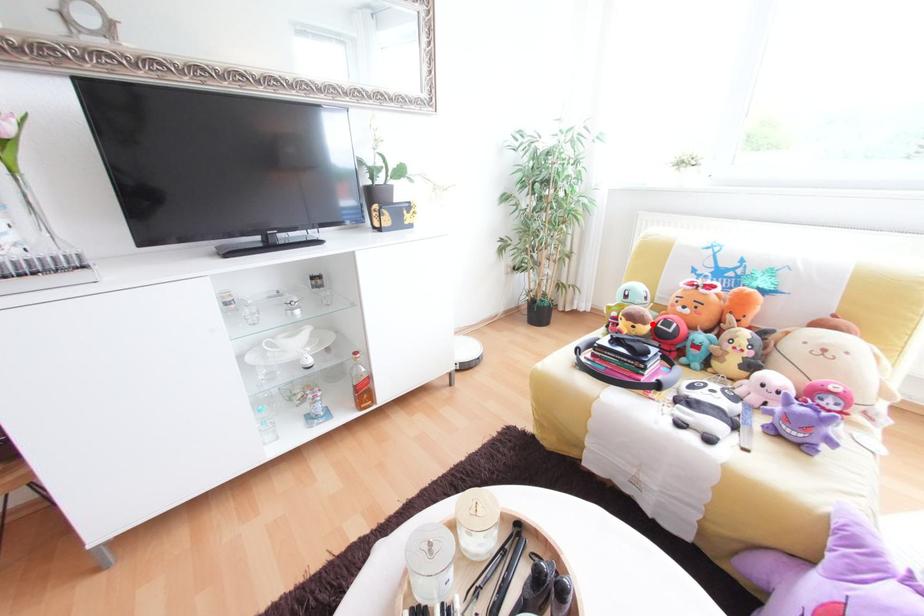
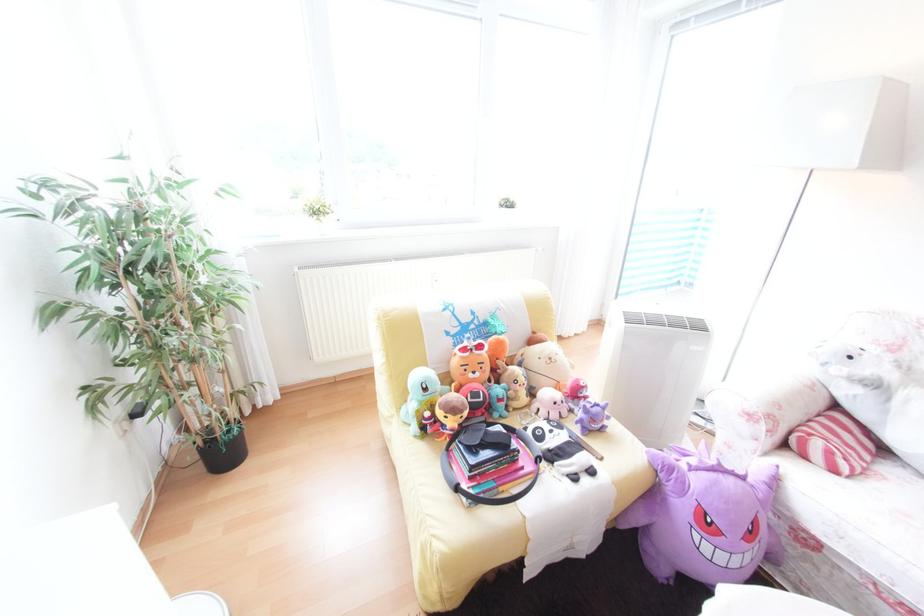
The point at the highlighted location is marked in the first image. Where is the corresponding point in the second image?

(476, 408)